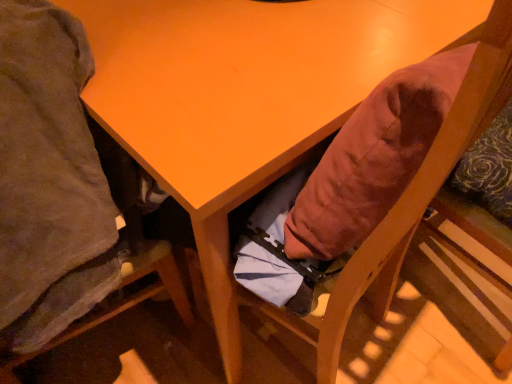
Question: Would you say wooden chair at lower left, acting as the 2th chair starting from the right, is inside or outside velvet-like orange cushion at lower right, the second chair positioned from the left?

Choices:
 (A) outside
 (B) inside

Answer: (A)

Question: In terms of height, does wooden chair at lower left, which appears as the first chair when viewed from the left, look taller or shorter compared to velvet-like orange cushion at lower right, the second chair positioned from the left?

Choices:
 (A) short
 (B) tall

Answer: (B)

Question: In terms of width, does wooden chair at lower left, which appears as the first chair when viewed from the left, look wider or thinner when compared to velvet-like orange cushion at lower right, the 1th chair from the right?

Choices:
 (A) wide
 (B) thin

Answer: (A)

Question: Is velvet-like orange cushion at lower right, the second chair positioned from the left, inside or outside of wooden chair at lower left, which appears as the first chair when viewed from the left?

Choices:
 (A) outside
 (B) inside

Answer: (A)

Question: Relative to wooden chair at lower left, acting as the 2th chair starting from the right, is velvet-like orange cushion at lower right, the second chair positioned from the left, in front or behind?

Choices:
 (A) behind
 (B) front

Answer: (A)

Question: Is velvet-like orange cushion at lower right, the second chair positioned from the left, wider or thinner than wooden chair at lower left, which appears as the first chair when viewed from the left?

Choices:
 (A) thin
 (B) wide

Answer: (A)

Question: Does point (499, 64) appear closer or farther from the camera than point (10, 150)?

Choices:
 (A) closer
 (B) farther

Answer: (A)